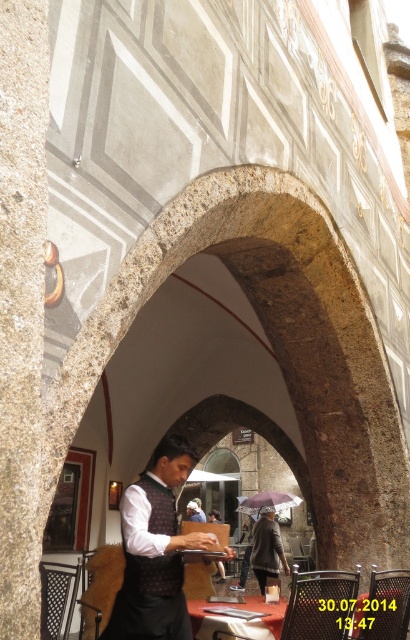
Question: From the image, what is the correct spatial relationship of wooden chair at lower left in relation to wooden table at center?

Choices:
 (A) right
 (B) left

Answer: (B)

Question: Can you confirm if dark brown vest at center is bigger than blue denim shirt at center?

Choices:
 (A) yes
 (B) no

Answer: (A)

Question: Does dark brown leather jacket at center come behind wooden chair at center?

Choices:
 (A) no
 (B) yes

Answer: (A)

Question: Which point is closer to the camera?

Choices:
 (A) (311, 564)
 (B) (332, 609)
 (C) (191, 508)
 (D) (255, 563)

Answer: (B)

Question: Which object is positioned farthest from the blue denim shirt at center?

Choices:
 (A) dark brown leather jacket at center
 (B) wooden chair at center
 (C) wooden chair at lower left
 (D) metallic mesh chair at center

Answer: (C)

Question: Among these points, which one is nearest to the camera?

Choices:
 (A) (266, 506)
 (B) (266, 544)
 (C) (189, 504)

Answer: (B)